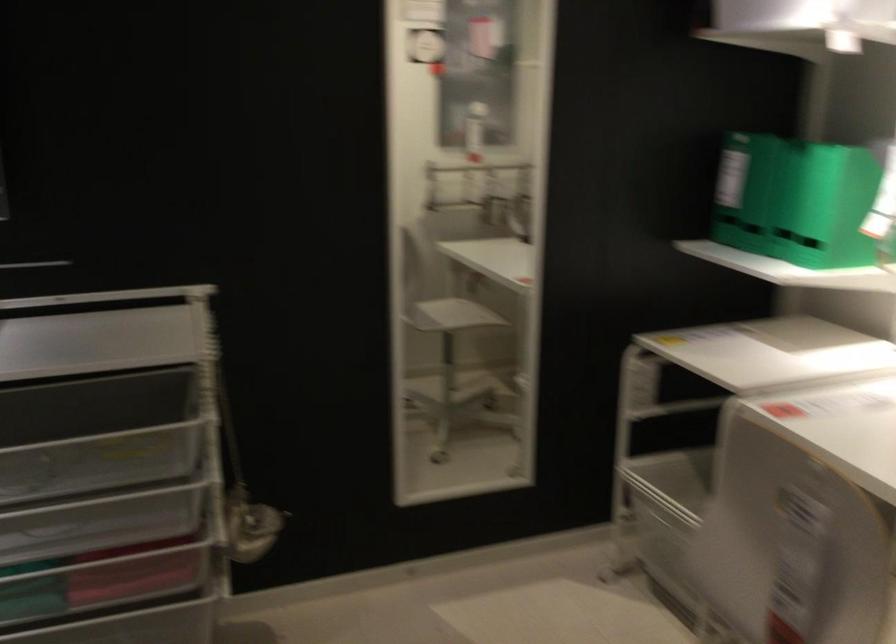
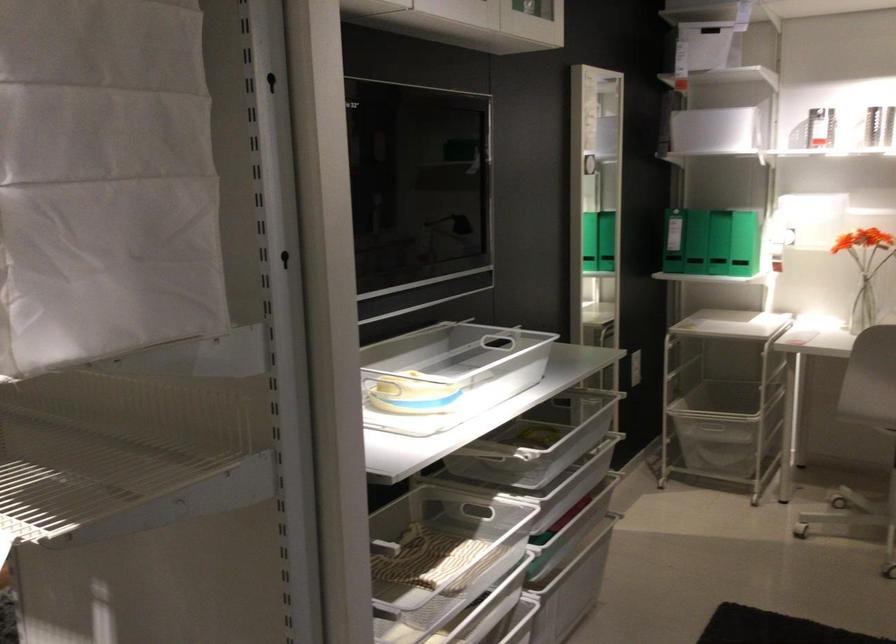
Where in the second image is the point corresponding to pixel 209 466 from the first image?

(561, 428)